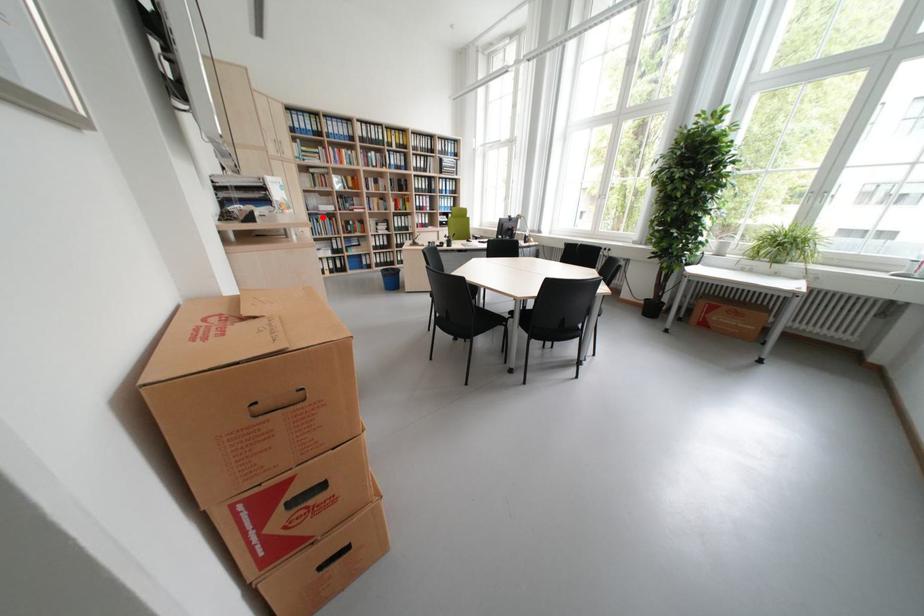
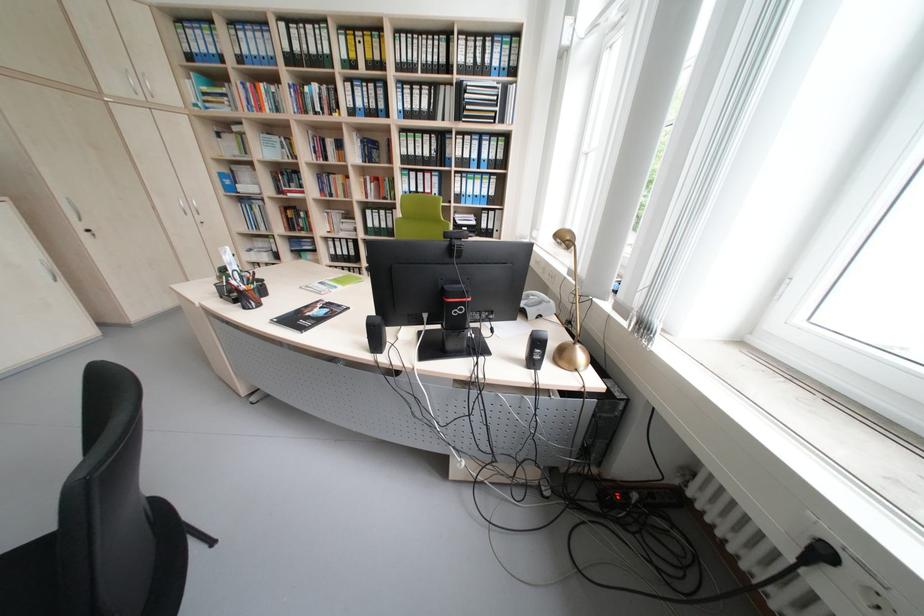
Find the pixel in the second image that matches the highlighted location in the first image.

(253, 201)